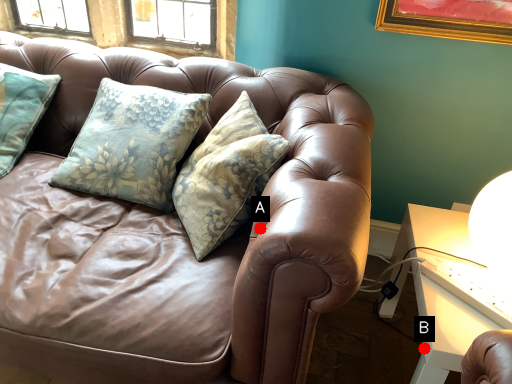
Question: Two points are circled on the image, labeled by A and B beside each circle. Among these points, which one is nearest to the camera?

Choices:
 (A) A is closer
 (B) B is closer

Answer: (A)